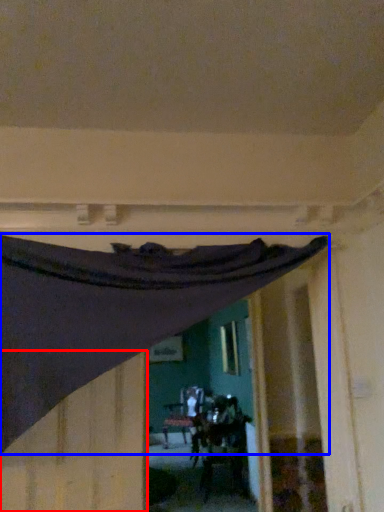
Question: Which object is closer to the camera taking this photo, plywood (highlighted by a red box) or curtain (highlighted by a blue box)?

Choices:
 (A) plywood
 (B) curtain

Answer: (B)